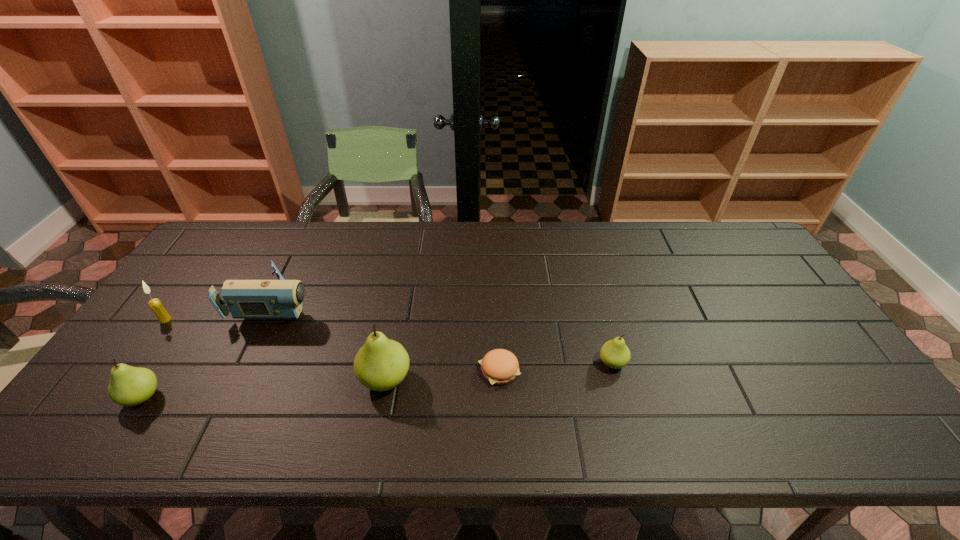
The width and height of the screenshot is (960, 540). Find the location of `free space located 0.090m on the right of the second object from left to right`. free space located 0.090m on the right of the second object from left to right is located at coordinates (200, 397).

The height and width of the screenshot is (540, 960). I want to click on vacant space located 0.110m on the left of the fourth object from left to right, so click(315, 380).

Find the location of a particular element. This screenshot has height=540, width=960. free region located on the right of the second shortest object is located at coordinates (706, 363).

You are a GUI agent. You are given a task and a screenshot of the screen. Output one action in this format:
    pyautogui.click(x=<x>, y=<y>)
    Task: Click on the free space located 0.210m on the back of the candle
    The image size is (960, 540).
    Given the screenshot: What is the action you would take?
    pyautogui.click(x=203, y=268)

Identify the location of free space located on the right of the shortest object. This screenshot has width=960, height=540. (557, 370).

Find the location of `vacant region located on the side of the camcorder with the flip-out screen`. vacant region located on the side of the camcorder with the flip-out screen is located at coordinates (425, 302).

Where is `patty situated at the near edge`? The image size is (960, 540). patty situated at the near edge is located at coordinates (499, 366).

This screenshot has width=960, height=540. Identify the location of pear present at the left edge. (129, 386).

Find the location of a particular element. This screenshot has width=960, height=540. candle at the left edge is located at coordinates (162, 315).

At what (x,y) coordinates should I click in order to perform the action: click on object that is positioned at the near left corner. Please return your answer as a coordinate pair (x, y). The width and height of the screenshot is (960, 540). Looking at the image, I should click on (129, 386).